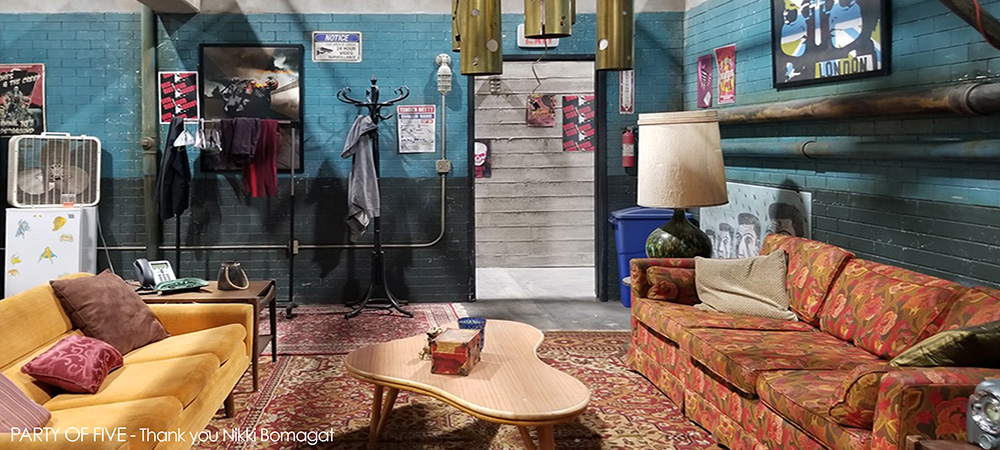
Where is `multicolored orange sofa`? The image size is (1000, 450). multicolored orange sofa is located at coordinates (758, 362), (880, 308), (818, 395), (713, 390), (678, 310), (651, 342).